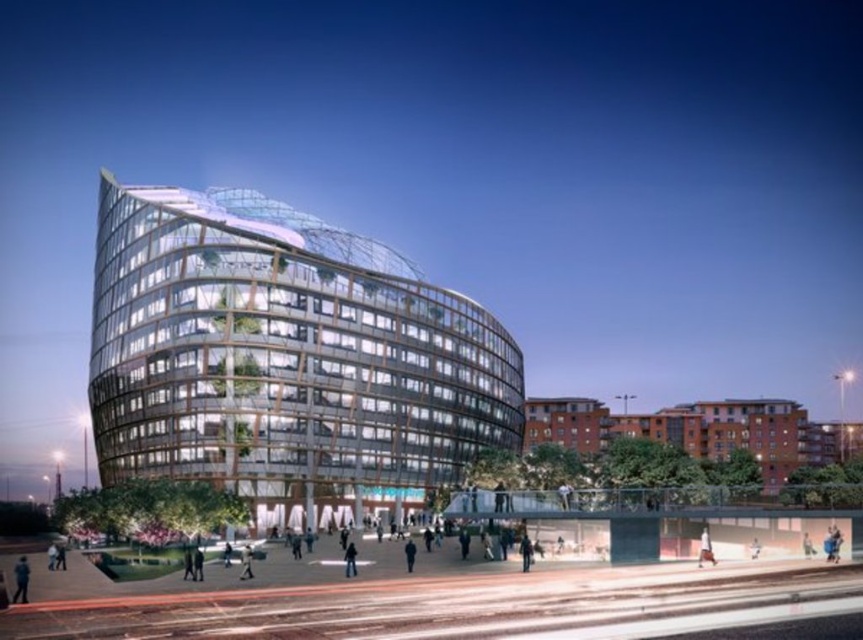
Question: Which point is closer to the camera?

Choices:
 (A) dark blue fabric at center
 (B) light gray fabric jacket at lower center
 (C) transparent glass building at center

Answer: (B)

Question: Can you confirm if blue fabric jacket at lower left is bigger than dark blue fabric at center?

Choices:
 (A) yes
 (B) no

Answer: (A)

Question: Which point is closer to the camera?

Choices:
 (A) (24, 595)
 (B) (345, 576)
 (C) (293, 372)
 (D) (250, 577)

Answer: (A)

Question: Which point appears closest to the camera in this image?

Choices:
 (A) (16, 596)
 (B) (193, 259)

Answer: (A)

Question: Does blue fabric jacket at lower left lie in front of light gray fabric jacket at lower center?

Choices:
 (A) yes
 (B) no

Answer: (A)

Question: Is transparent glass building at center in front of blue fabric jacket at lower left?

Choices:
 (A) no
 (B) yes

Answer: (A)